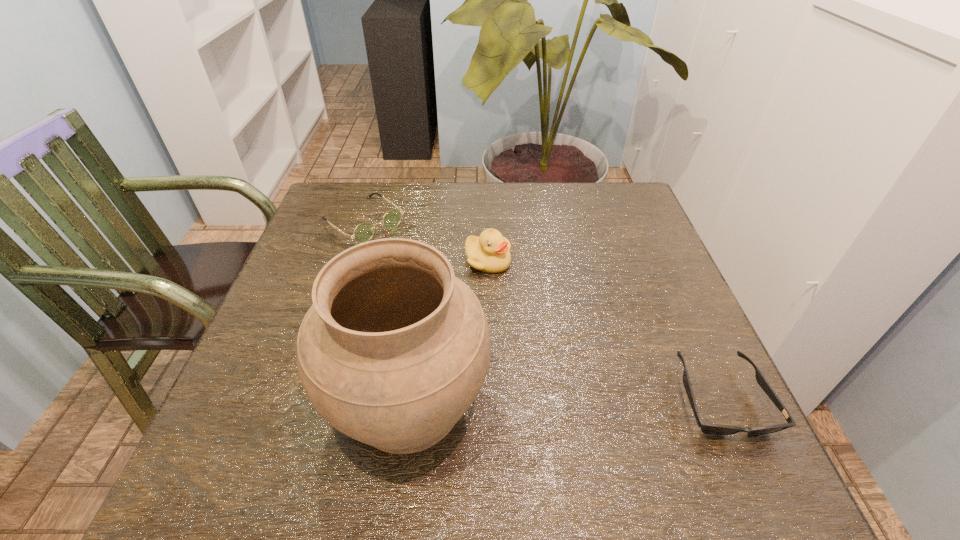
The image size is (960, 540). Find the location of `free location at the left edge of the desktop`. free location at the left edge of the desktop is located at coordinates (304, 245).

At what (x,y) coordinates should I click in order to perform the action: click on vacant space at the right edge of the desktop. Please return your answer as a coordinate pair (x, y). This screenshot has height=540, width=960. Looking at the image, I should click on (654, 351).

The width and height of the screenshot is (960, 540). I want to click on vacant area between the shortest object and the spectacles, so click(x=541, y=310).

The image size is (960, 540). Find the location of `free space between the spectacles and the third shortest object`. free space between the spectacles and the third shortest object is located at coordinates (425, 241).

This screenshot has width=960, height=540. In order to click on free space between the second shortest object and the duckling in this screenshot , I will do `click(425, 241)`.

Where is `vacant region between the rightmost object and the urn`? The image size is (960, 540). vacant region between the rightmost object and the urn is located at coordinates (564, 401).

You are a GUI agent. You are given a task and a screenshot of the screen. Output one action in this format:
    pyautogui.click(x=<x>, y=<y>)
    Task: Click on the free point between the rightmost object and the tallest object
    Image resolution: width=960 pixels, height=540 pixels.
    Given the screenshot: What is the action you would take?
    pyautogui.click(x=564, y=401)

Image resolution: width=960 pixels, height=540 pixels. Identify the location of empty space between the shortest object and the tallest object. (564, 401).

Where is `vacant region between the third tallest object and the duckling`? The image size is (960, 540). vacant region between the third tallest object and the duckling is located at coordinates (425, 241).

This screenshot has height=540, width=960. What are the coordinates of `free space that is in between the sunglasses and the duckling` in the screenshot? It's located at (604, 330).